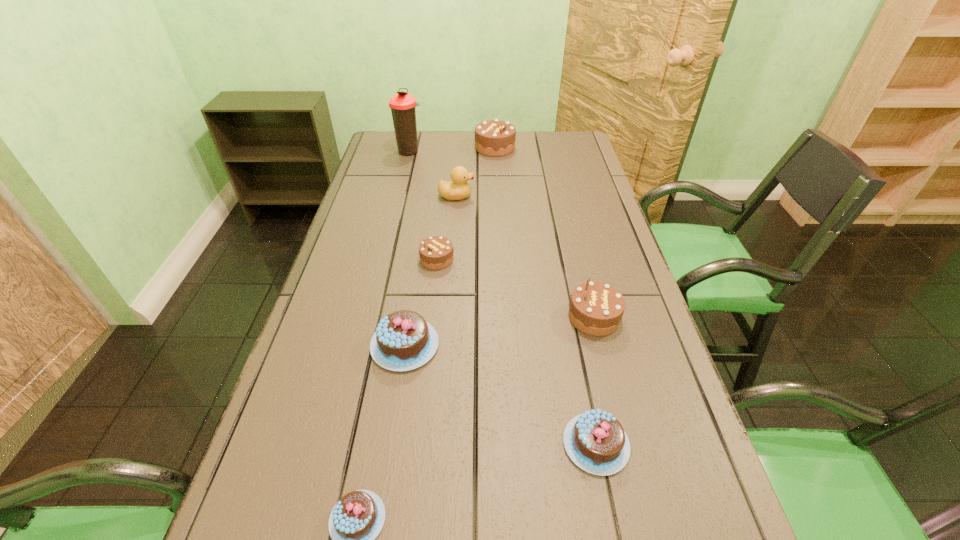
Where is `chocolate cake that is at the far edge`? chocolate cake that is at the far edge is located at coordinates (495, 138).

You are a GUI agent. You are given a task and a screenshot of the screen. Output one action in this format:
    pyautogui.click(x=<x>, y=<y>)
    Task: Click on the thermos bottle at the left edge
    
    Given the screenshot: What is the action you would take?
    pyautogui.click(x=402, y=105)

Locate an element on the screen. This screenshot has height=540, width=960. chocolate cake positioned at the left edge is located at coordinates (403, 341).

Where is `object present at the far left corner`? The image size is (960, 540). object present at the far left corner is located at coordinates (402, 105).

Identify the location of vacant space at the far edge of the desktop. (484, 157).

Where is `blank space at the left edge of the desktop`? The image size is (960, 540). blank space at the left edge of the desktop is located at coordinates (304, 409).

In the image, there is a desktop. Identify the location of vacant space at the right edge. (647, 366).

Find the location of `free region at the far left corner of the desktop`. free region at the far left corner of the desktop is located at coordinates [415, 160].

I want to click on free region at the far right corner, so click(563, 137).

The width and height of the screenshot is (960, 540). In order to click on free space between the second smallest brown chocolate cake and the duckling in this screenshot , I will do `click(525, 256)`.